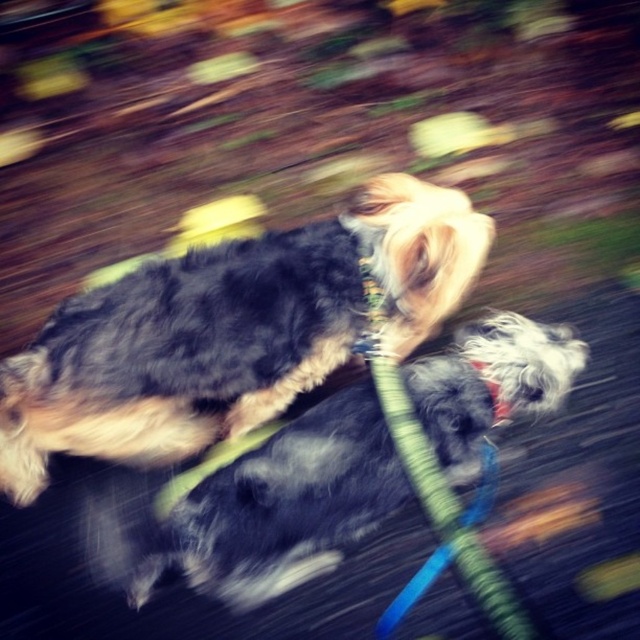
Is fluffy gray dog at center wider than green fabric leash at center?

Yes, fluffy gray dog at center is wider than green fabric leash at center.

Locate an element on the screen. This screenshot has height=640, width=640. fluffy gray dog at center is located at coordinates (253, 509).

You are a GUI agent. You are given a task and a screenshot of the screen. Output one action in this format:
    pyautogui.click(x=<x>, y=<y>)
    Task: Click on the fluffy gray dog at center
    
    Given the screenshot: What is the action you would take?
    (x=253, y=509)

Looking at this image, can you confirm if fluffy black dog at center is shorter than fluffy gray dog at center?

In fact, fluffy black dog at center may be taller than fluffy gray dog at center.

In the scene shown: Is fluffy black dog at center thinner than fluffy gray dog at center?

In fact, fluffy black dog at center might be wider than fluffy gray dog at center.

In order to click on fluffy black dog at center in this screenshot , I will do `click(230, 332)`.

Can you confirm if fluffy black dog at center is bigger than green fabric neckband at center?

Result: Yes.

Consider the image. Who is more distant from viewer, (211, 376) or (496, 385)?

Positioned behind is point (211, 376).

Who is more forward, [77,449] or [481,376]?

Point [481,376] is in front.

Locate an element on the screen. The image size is (640, 640). fluffy black dog at center is located at coordinates (230, 332).